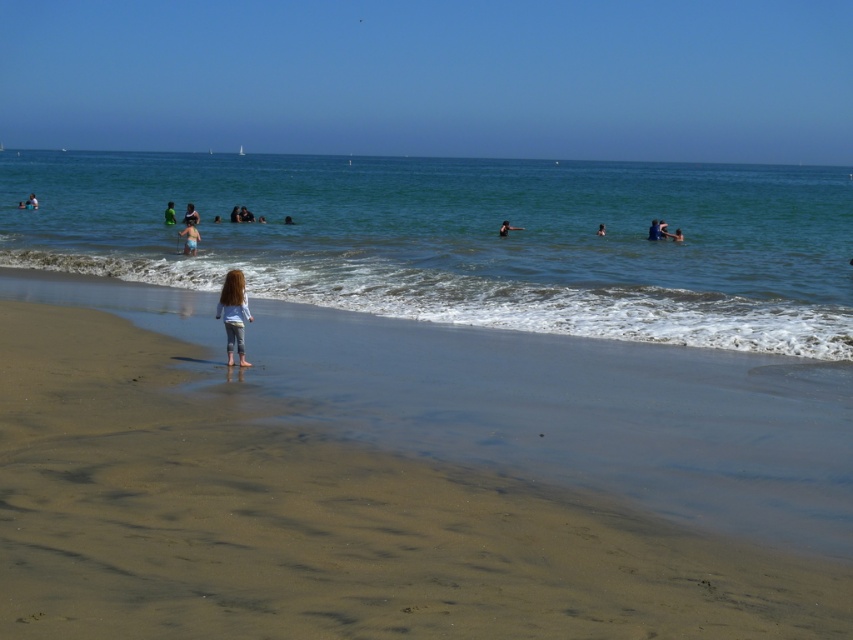
Who is taller, sandy beach at lower left or dark blue fabric at center?

With more height is sandy beach at lower left.

Which is in front, point (828, 525) or point (502, 225)?

Point (828, 525) is in front.

I want to click on sandy beach at lower left, so click(x=405, y=477).

Who is shorter, white cotton shirt at center or green fabric person at center?

Standing shorter between the two is green fabric person at center.

Between point (184, 211) and point (173, 218), which one is positioned behind?

Positioned behind is point (184, 211).

Identify the location of white cotton shirt at center. The image size is (853, 640). click(x=190, y=214).

Looking at this image, who is more forward, (x=509, y=236) or (x=165, y=218)?

Point (x=509, y=236) is more forward.

Is point (105, 188) positioned behind point (167, 211)?

Yes, it is.

Locate an element on the screen. The image size is (853, 640). clear blue water at center is located at coordinates (466, 240).

Locate an element on the screen. This screenshot has height=640, width=853. clear blue water at center is located at coordinates (466, 240).